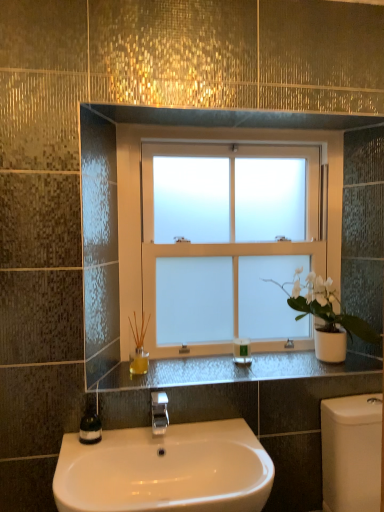
Find the location of a particular element. vacant space that is to the left of silver metallic faucet at center is located at coordinates (128, 442).